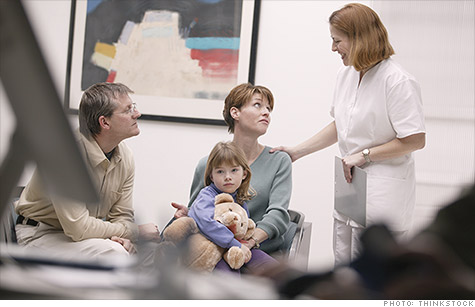
This screenshot has width=475, height=307. Find the location of `computer monitor`. computer monitor is located at coordinates (42, 121).